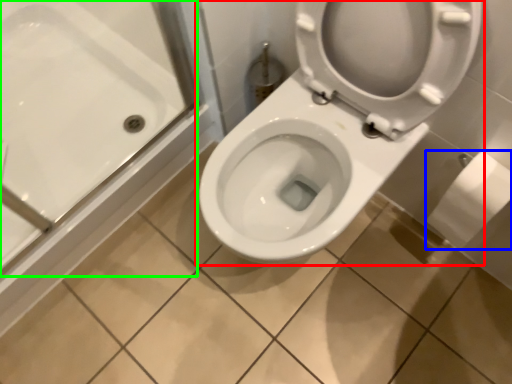
Question: Considering the real-world distances, which object is closest to toilet (highlighted by a red box)? toilet paper (highlighted by a blue box) or bath (highlighted by a green box).

Choices:
 (A) toilet paper
 (B) bath

Answer: (A)